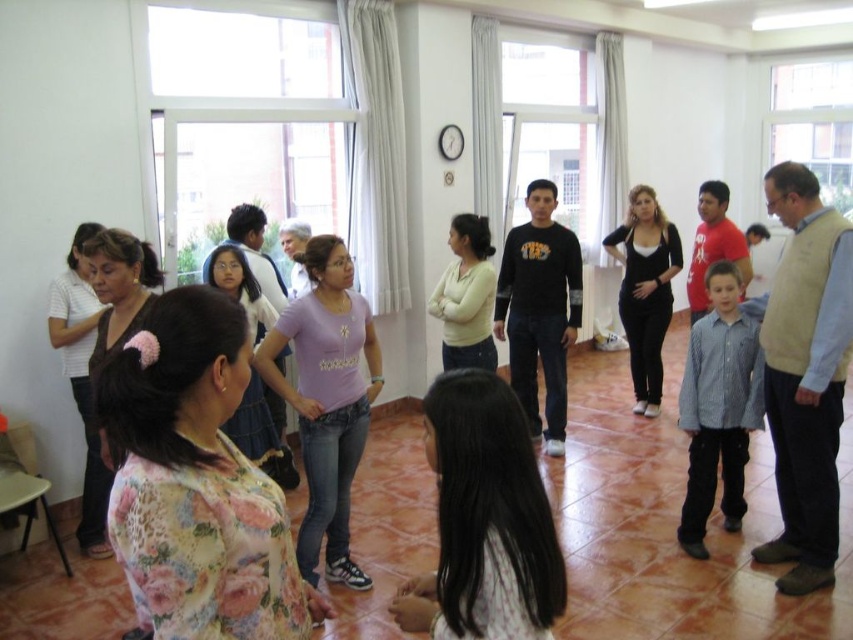
The width and height of the screenshot is (853, 640). What do you see at coordinates (670, 531) in the screenshot?
I see `floral-patterned blouse at lower left` at bounding box center [670, 531].

Who is positioned more to the right, floral-patterned blouse at lower left or light brown hair at center?

Positioned to the right is floral-patterned blouse at lower left.

Image resolution: width=853 pixels, height=640 pixels. I want to click on floral-patterned blouse at lower left, so click(x=670, y=531).

Looking at this image, which is more to the left, floral-patterned blouse at lower left or blue striped shirt at lower right?

blue striped shirt at lower right is more to the left.

Who is positioned more to the right, floral-patterned blouse at lower left or blue striped shirt at lower right?

From the viewer's perspective, floral-patterned blouse at lower left appears more on the right side.

Between point (57, 579) and point (749, 424), which one is positioned behind?

Positioned behind is point (749, 424).

The image size is (853, 640). What are the coordinates of `floral-patterned blouse at lower left` in the screenshot? It's located at (670, 531).

Can you confirm if light brown hair at center is smaller than blue striped shirt at lower right?

Indeed, light brown hair at center has a smaller size compared to blue striped shirt at lower right.

Between point (437, 464) and point (689, 513), which one is positioned in front?

Point (437, 464) is more forward.

Locate an element on the screen. light brown hair at center is located at coordinates pyautogui.click(x=485, y=520).